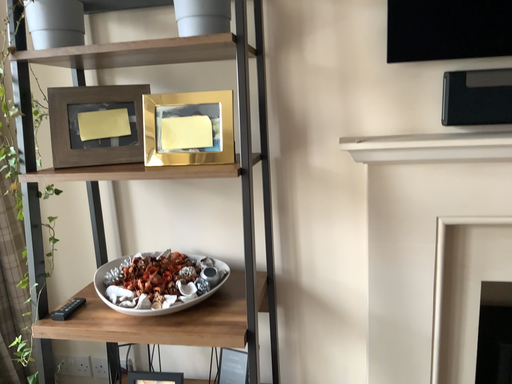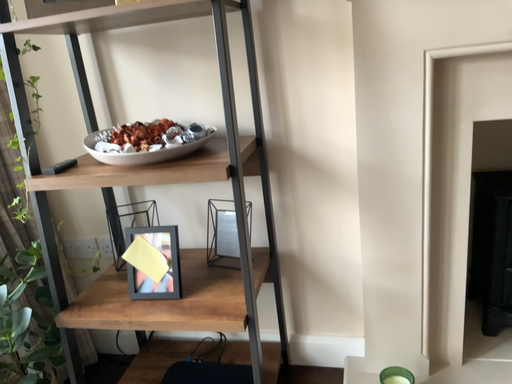
Question: Which way did the camera rotate in the video?

Choices:
 (A) rotated upward
 (B) rotated downward

Answer: (B)